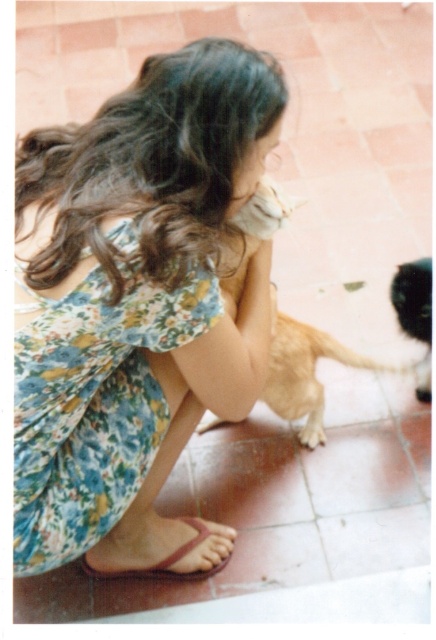
Question: Which of the following is the closest to the observer?

Choices:
 (A) golden fur dog at center
 (B) floral fabric dress at center
 (C) pink leather sandal at lower center

Answer: (B)

Question: Is golden fur dog at center bigger than black fuzzy cat at lower right?

Choices:
 (A) no
 (B) yes

Answer: (B)

Question: Which point is farther from the camera taking this photo?

Choices:
 (A) (88, 490)
 (B) (215, 422)
 (C) (146, 572)

Answer: (B)

Question: Which point is closer to the camera?

Choices:
 (A) (68, 500)
 (B) (272, 360)
 (C) (394, 298)

Answer: (A)

Question: Can you confirm if floral fabric dress at center is positioned below black fuzzy cat at lower right?

Choices:
 (A) yes
 (B) no

Answer: (A)

Question: Is floral fabric dress at center further to camera compared to black fuzzy cat at lower right?

Choices:
 (A) no
 (B) yes

Answer: (A)